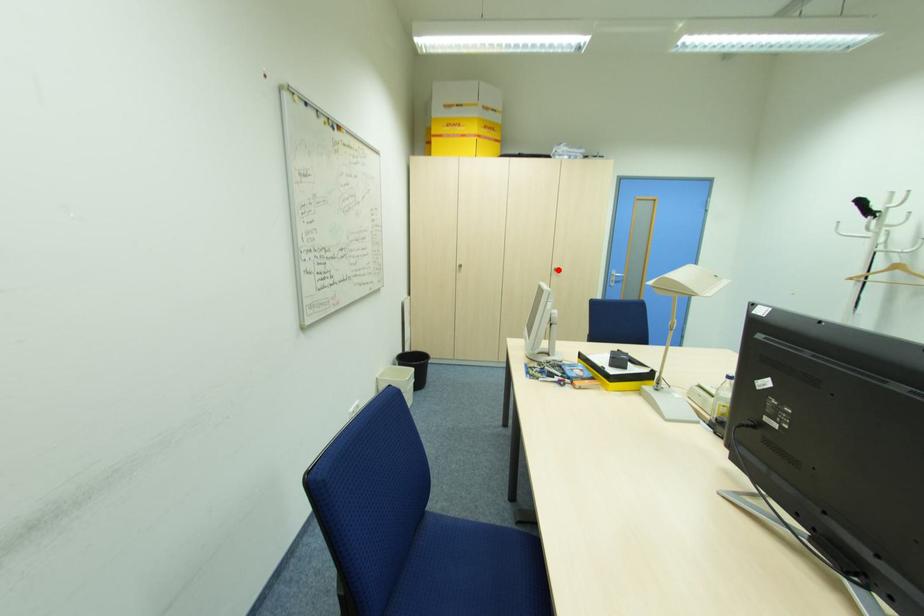
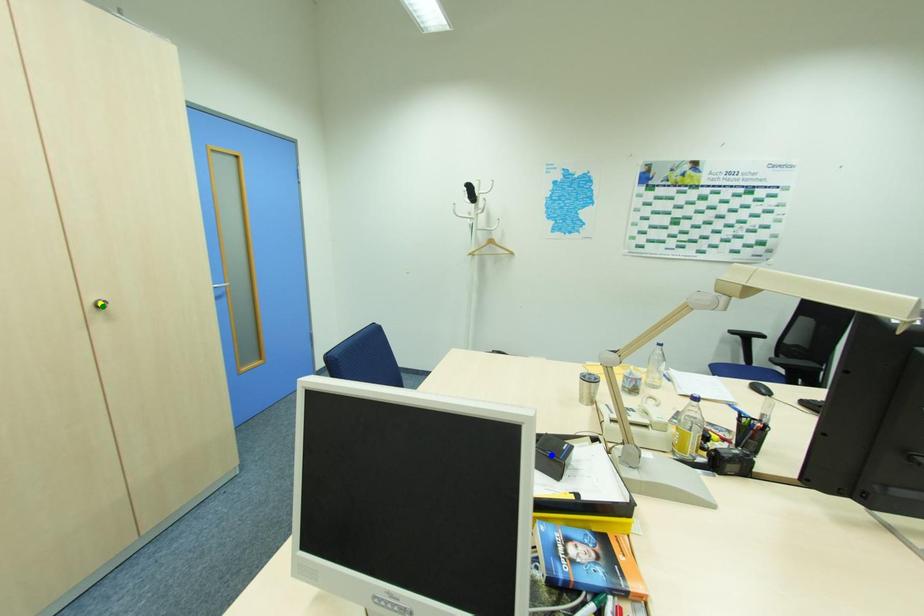
Question: I am providing you with two images of the same scene from different viewpoints. A red point is marked on the first image. You are given multiple points on the second image. Which point in image 2 represents the same 3d spot as the red point in image 1?

Choices:
 (A) yellow point
 (B) blue point
 (C) green point

Answer: (C)